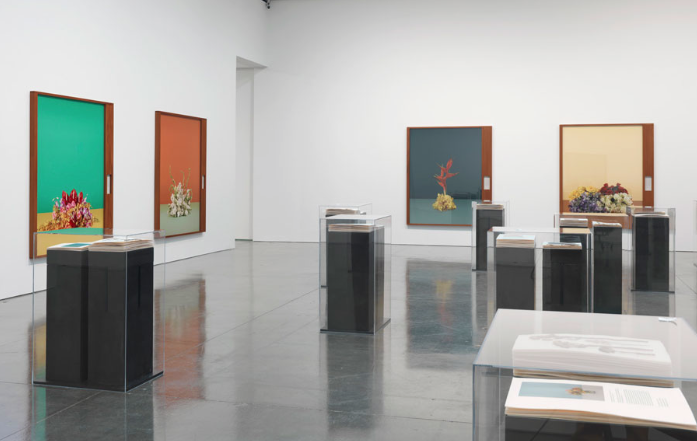
You are a GUI agent. You are given a task and a screenshot of the screen. Output one action in this format:
    pyautogui.click(x=<x>, y=<y>)
    Task: Click on the floor tile
    This screenshot has width=697, height=441.
    Given the screenshot: What is the action you would take?
    pyautogui.click(x=277, y=365)